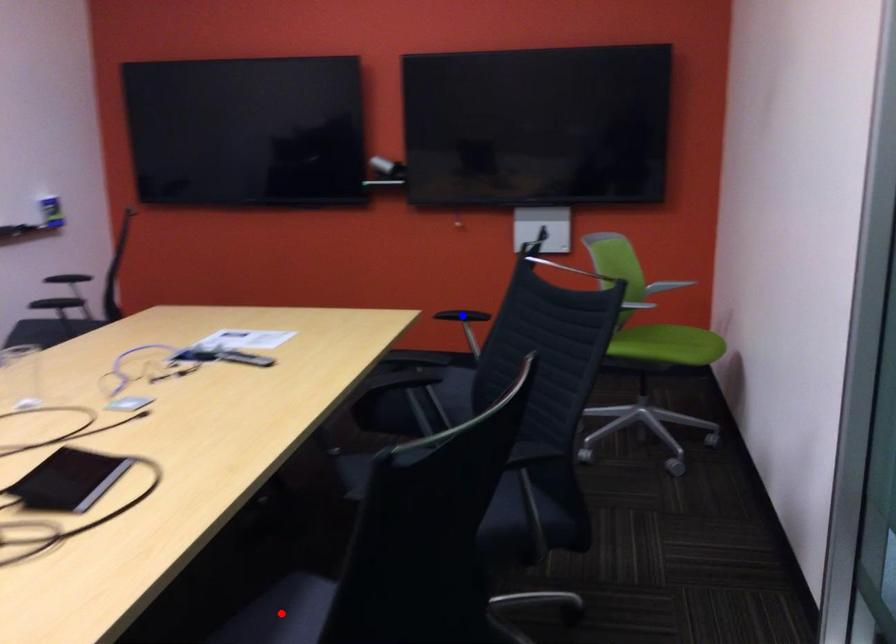
Question: Which of the two points in the image is closer to the camera?

Choices:
 (A) Blue point is closer.
 (B) Red point is closer.

Answer: (B)